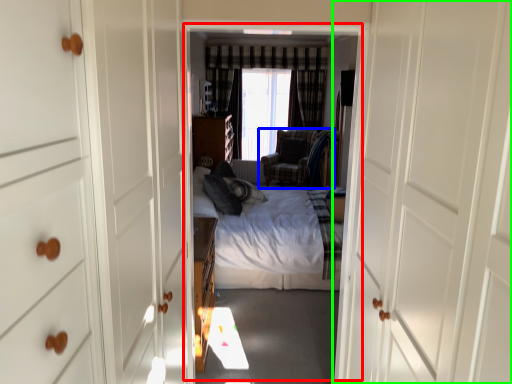
Question: Which object is positioned closest to residence (highlighted by a red box)? Select from chair (highlighted by a blue box) and door (highlighted by a green box).

Choices:
 (A) chair
 (B) door

Answer: (A)